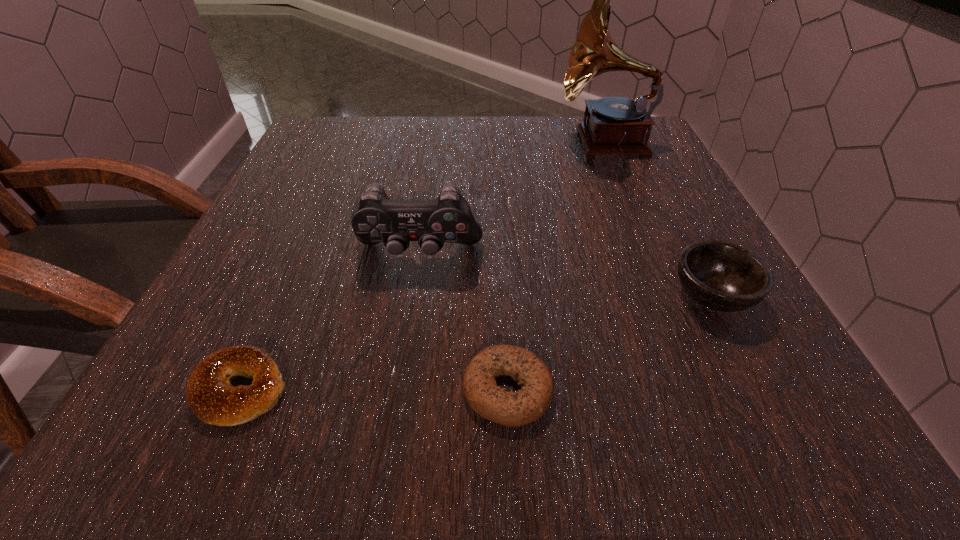
Identify the location of free spot located on the left of the third tallest object. Image resolution: width=960 pixels, height=540 pixels. (425, 295).

You are a GUI agent. You are given a task and a screenshot of the screen. Output one action in this format:
    pyautogui.click(x=<x>, y=<y>)
    Task: Click on the free space located on the back of the right bagel
    
    Given the screenshot: What is the action you would take?
    pyautogui.click(x=498, y=216)

Find the location of a particular element. vacant space located on the back of the left bagel is located at coordinates (293, 272).

This screenshot has width=960, height=540. In order to click on object at the far edge in this screenshot , I will do `click(615, 125)`.

This screenshot has width=960, height=540. What are the coordinates of `object that is at the left edge` in the screenshot? It's located at (210, 395).

Where is `phonograph_record that is at the right edge`? This screenshot has height=540, width=960. phonograph_record that is at the right edge is located at coordinates (615, 125).

This screenshot has height=540, width=960. What are the coordinates of `bowl present at the right edge` in the screenshot? It's located at (725, 277).

Where is `object present at the near left corner`? object present at the near left corner is located at coordinates tap(210, 395).

At what (x,y) coordinates should I click in order to perform the action: click on object that is at the far right corner. Please return your answer as a coordinate pair (x, y). This screenshot has height=540, width=960. Looking at the image, I should click on (615, 125).

Identify the location of vacant space at the far edge of the desktop. This screenshot has height=540, width=960. (489, 159).